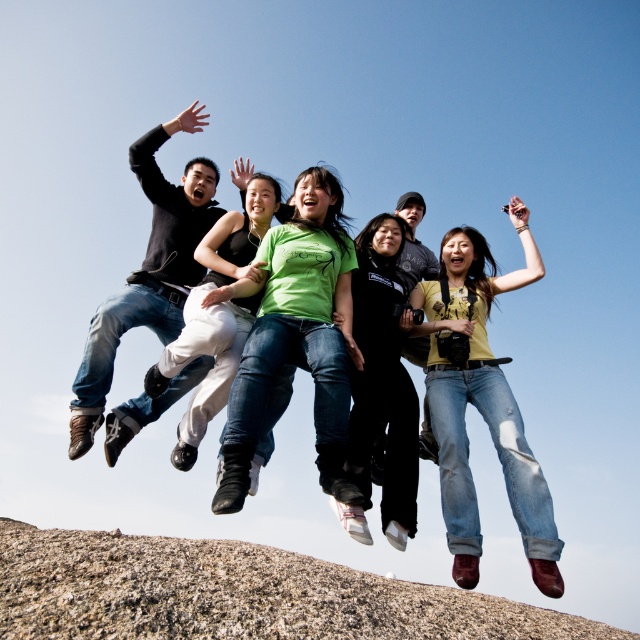
Question: From the image, what is the correct spatial relationship of black matte pants at center in relation to matte green shirt at center?

Choices:
 (A) left
 (B) right

Answer: (B)

Question: Is denim jeans at center behind black matte pants at center?

Choices:
 (A) no
 (B) yes

Answer: (B)

Question: Which of the following is the closest to the observer?

Choices:
 (A) (353, 298)
 (B) (241, 342)
 (C) (324, 458)
 (D) (104, 570)

Answer: (C)

Question: Which of the following is the closest to the observer?

Choices:
 (A) (x=269, y=221)
 (B) (x=362, y=317)

Answer: (B)

Question: Which object appears farthest from the camera in this image?

Choices:
 (A) black matte pants at center
 (B) denim jeans at center
 (C) matte green shirt at center
 (D) granite rock at lower center

Answer: (B)

Question: Can you confirm if green matte shirt at center is thinner than denim jeans at center?

Choices:
 (A) yes
 (B) no

Answer: (B)